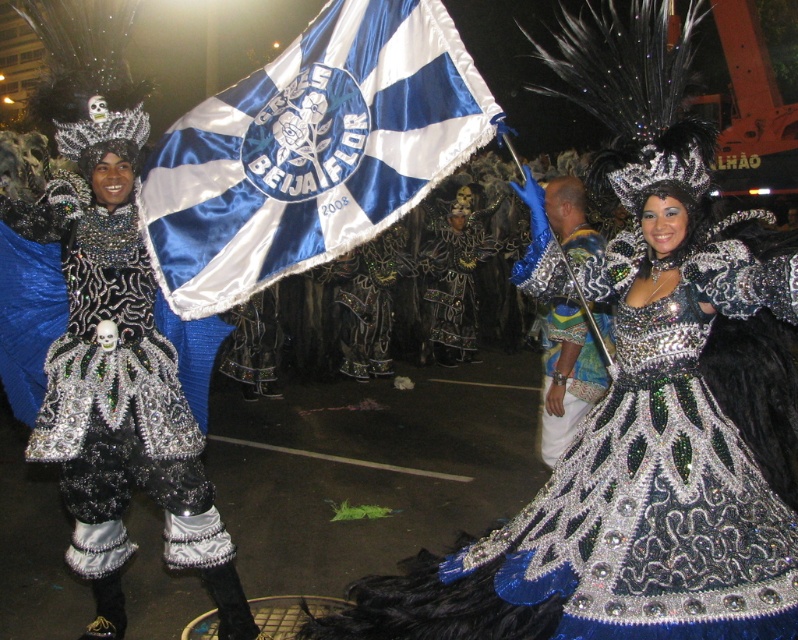
Is sparkly silver dress at center to the left of blue satin flag at center from the viewer's perspective?

No, sparkly silver dress at center is not to the left of blue satin flag at center.

Does sparkly silver dress at center have a smaller size compared to blue satin flag at center?

Incorrect, sparkly silver dress at center is not smaller in size than blue satin flag at center.

Does point (725, 611) come closer to viewer compared to point (378, 189)?

Yes, point (725, 611) is closer to viewer.

This screenshot has height=640, width=798. I want to click on sparkly silver dress at center, so click(x=626, y=493).

Between blue satin flag at center and shiny silver dress at center, which one is positioned lower?

Positioned lower is shiny silver dress at center.

In the scene shown: Does blue satin flag at center appear on the left side of shiny silver dress at center?

Incorrect, blue satin flag at center is not on the left side of shiny silver dress at center.

Between point (305, 48) and point (66, 422), which one is positioned behind?

The point (66, 422) is behind.

Image resolution: width=798 pixels, height=640 pixels. Identify the location of blue satin flag at center. (310, 150).

Based on the photo, can you confirm if sparkly silver dress at center is shorter than shiny silver dress at center?

Correct, sparkly silver dress at center is not as tall as shiny silver dress at center.

Does point (656, 627) come closer to viewer compared to point (184, 445)?

Yes.

Does point (512, 620) come behind point (190, 528)?

No.

Image resolution: width=798 pixels, height=640 pixels. In order to click on sparkly silver dress at center in this screenshot , I will do `click(626, 493)`.